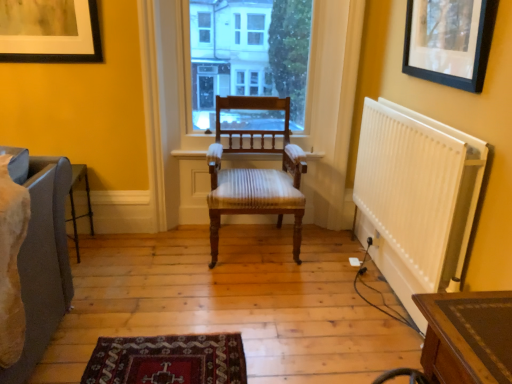
Question: Does matte black picture frame at upper left, the second picture frame from the front, touch transparent glass window at center?

Choices:
 (A) yes
 (B) no

Answer: (B)

Question: From the image's perspective, would you say matte black picture frame at upper left, the second picture frame from the front, is shown under transparent glass window at center?

Choices:
 (A) yes
 (B) no

Answer: (B)

Question: Does matte black picture frame at upper left, the second picture frame from the right, turn towards transparent glass window at center?

Choices:
 (A) yes
 (B) no

Answer: (B)

Question: Is matte black picture frame at upper left, arranged as the 1th picture frame when viewed from the back, thinner than transparent glass window at center?

Choices:
 (A) no
 (B) yes

Answer: (B)

Question: Is matte black picture frame at upper left, marked as the first picture frame in a left-to-right arrangement, wider than transparent glass window at center?

Choices:
 (A) no
 (B) yes

Answer: (A)

Question: Is the depth of matte black picture frame at upper left, the second picture frame from the right, greater than that of transparent glass window at center?

Choices:
 (A) no
 (B) yes

Answer: (A)

Question: Is matte black picture frame at upper left, arranged as the 1th picture frame when viewed from the back, smaller than black matte picture frame at upper right, the 1th picture frame from the right?

Choices:
 (A) no
 (B) yes

Answer: (A)

Question: Is matte black picture frame at upper left, the second picture frame from the front, outside black matte picture frame at upper right, the 1th picture frame from the right?

Choices:
 (A) no
 (B) yes

Answer: (B)

Question: Does matte black picture frame at upper left, marked as the first picture frame in a left-to-right arrangement, appear on the right side of black matte picture frame at upper right, the 1th picture frame from the right?

Choices:
 (A) no
 (B) yes

Answer: (A)

Question: Is matte black picture frame at upper left, arranged as the 1th picture frame when viewed from the back, far away from black matte picture frame at upper right, placed as the 2th picture frame when sorted from left to right?

Choices:
 (A) no
 (B) yes

Answer: (B)

Question: Is matte black picture frame at upper left, arranged as the 1th picture frame when viewed from the back, with black matte picture frame at upper right, the 2th picture frame viewed from the back?

Choices:
 (A) no
 (B) yes

Answer: (A)

Question: From the image's perspective, would you say matte black picture frame at upper left, arranged as the 1th picture frame when viewed from the back, is positioned over black matte picture frame at upper right, the 2th picture frame viewed from the back?

Choices:
 (A) no
 (B) yes

Answer: (B)

Question: Is black matte picture frame at upper right, the 2th picture frame viewed from the back, not near matte black picture frame at upper left, marked as the first picture frame in a left-to-right arrangement?

Choices:
 (A) yes
 (B) no

Answer: (A)